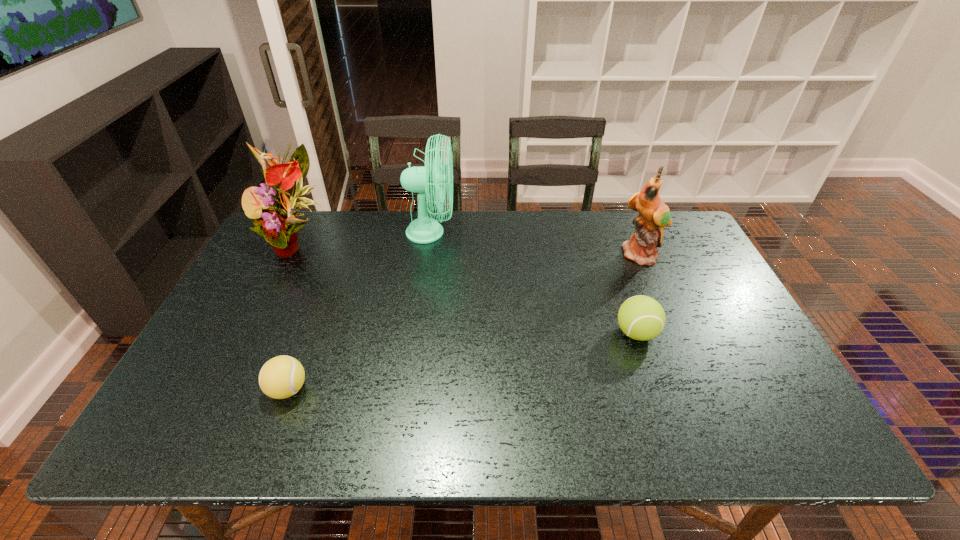
I want to click on free spot that satisfies the following two spatial constraints: 1. on the front-facing side of the right tennis ball; 2. on the right side of the bouquet, so click(255, 333).

Find the location of a particular element. The width and height of the screenshot is (960, 540). free space that satisfies the following two spatial constraints: 1. in front of the third object from right to left to blow air; 2. on the back side of the right tennis ball is located at coordinates (417, 333).